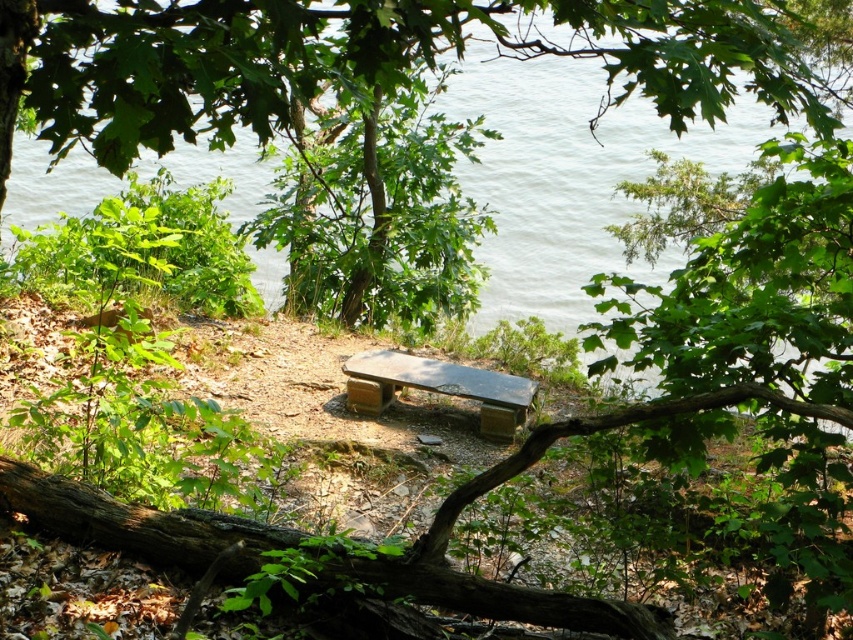
You are planning to place a small picnic basket on the ground between the green leafy tree at center and the smooth wooden bench at center. Based on the space between them, will the basket fit comfortably without being crowded?

The green leafy tree at center might be wider than the smooth wooden bench at center, so the space between them could be sufficient for placing the picnic basket comfortably.

You are sitting on the smooth wooden bench at center and want to see the view of the water. Since the green leafy tree at center is blocking your view, can you move to the right side of the bench to get a better view?

The green leafy tree at center is bigger than the smooth wooden bench at center, so moving to the right side of the bench might not fully clear the view as the tree is larger and likely still obstructs the water view.

You are sitting on the smooth wooden bench at center and want to reach out to touch the green leafy tree at center. Can you do so without moving from your seat?

The green leafy tree at center is closer to the viewer than the smooth wooden bench at center, so yes, you can reach out to touch it without moving from your seat.